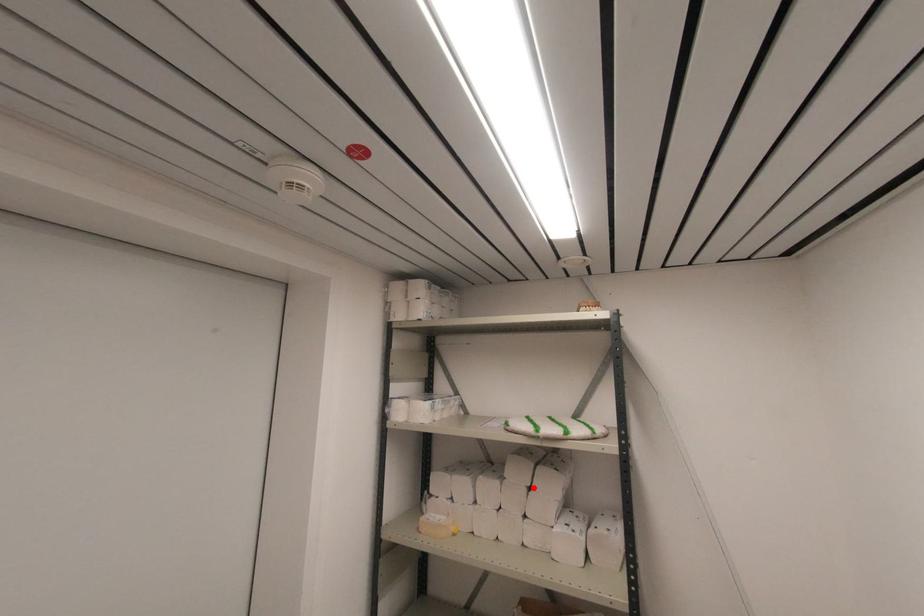
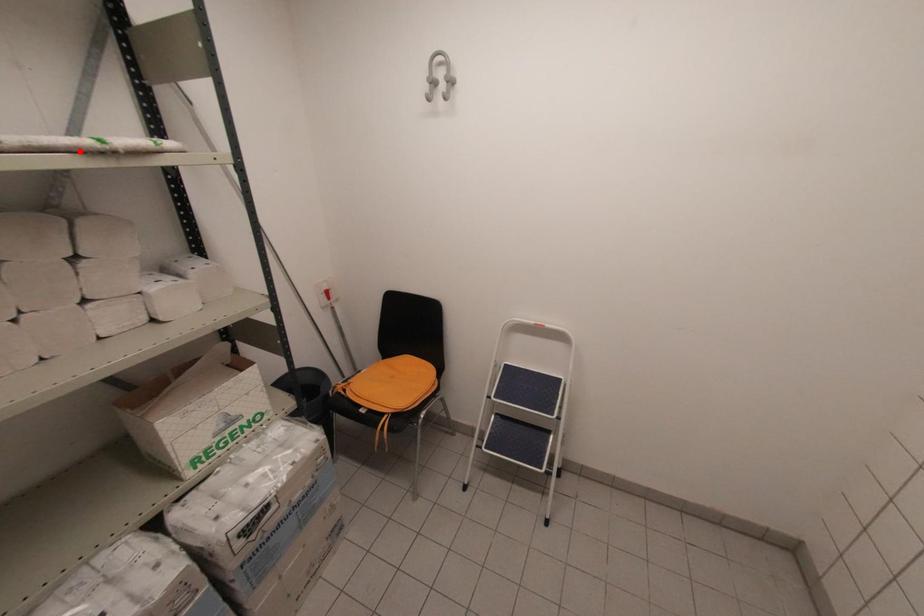
I am providing you with two images of the same scene from different viewpoints. A red point is marked on the first image and another point is marked on the second image. Do the highlighted points in image1 and image2 indicate the same real-world spot?

No